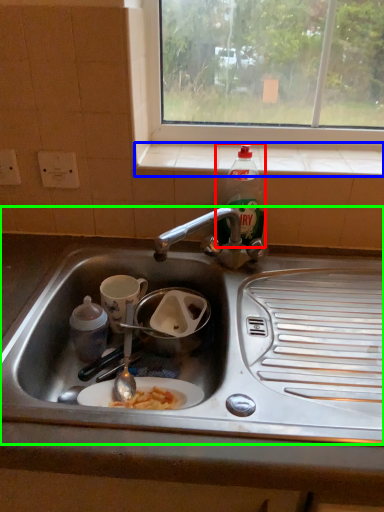
Question: Which object is positioned closest to bottle (highlighted by a red box)? Select from window sill (highlighted by a blue box) and sink (highlighted by a green box).

Choices:
 (A) window sill
 (B) sink

Answer: (A)